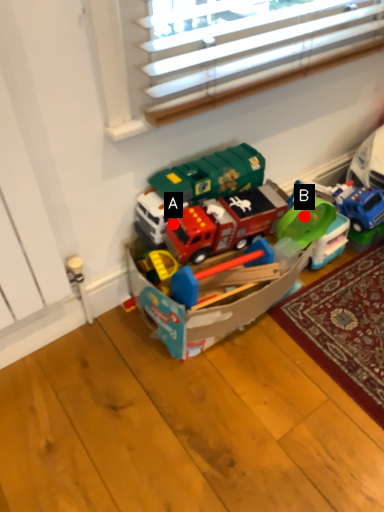
Question: Two points are circled on the image, labeled by A and B beside each circle. Which point is closer to the camera?

Choices:
 (A) A is closer
 (B) B is closer

Answer: (A)